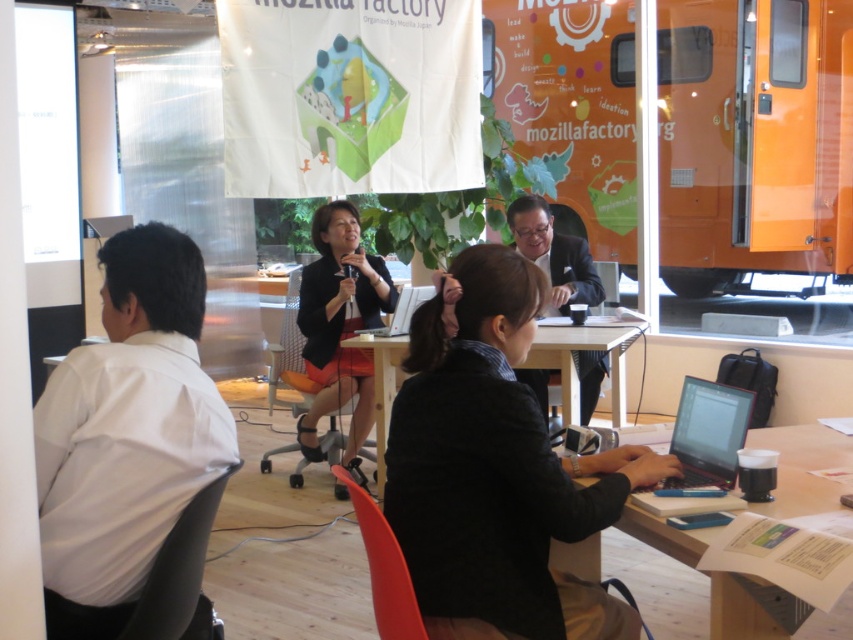
Question: Which of the following is the farthest from the observer?

Choices:
 (A) dark suit at center
 (B) black fabric jacket at center

Answer: (A)

Question: Is dark suit at center to the left of black glossy laptop at lower right from the viewer's perspective?

Choices:
 (A) no
 (B) yes

Answer: (B)

Question: Can you confirm if black matte blazer at center is positioned to the left of silver metallic laptop at center?

Choices:
 (A) no
 (B) yes

Answer: (B)

Question: Which of these objects is positioned closest to the wooden table at lower right?

Choices:
 (A) dark suit at center
 (B) white glossy table at center
 (C) white smooth shirt at left

Answer: (C)

Question: Does white smooth shirt at left have a greater width compared to black glossy laptop at lower right?

Choices:
 (A) yes
 (B) no

Answer: (A)

Question: Which is farther from the white smooth shirt at left?

Choices:
 (A) silver metallic laptop at center
 (B) white glossy table at center
 (C) dark suit at center

Answer: (C)